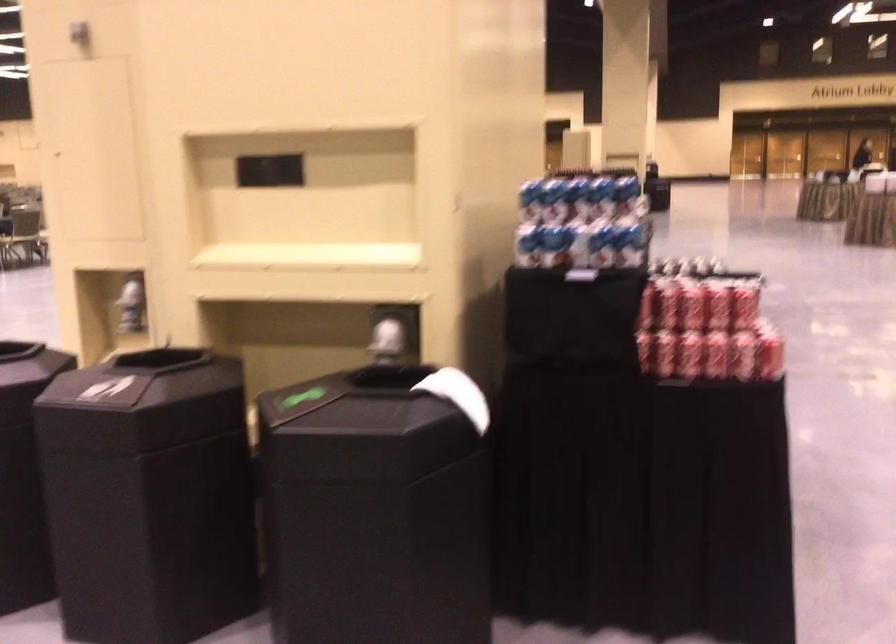
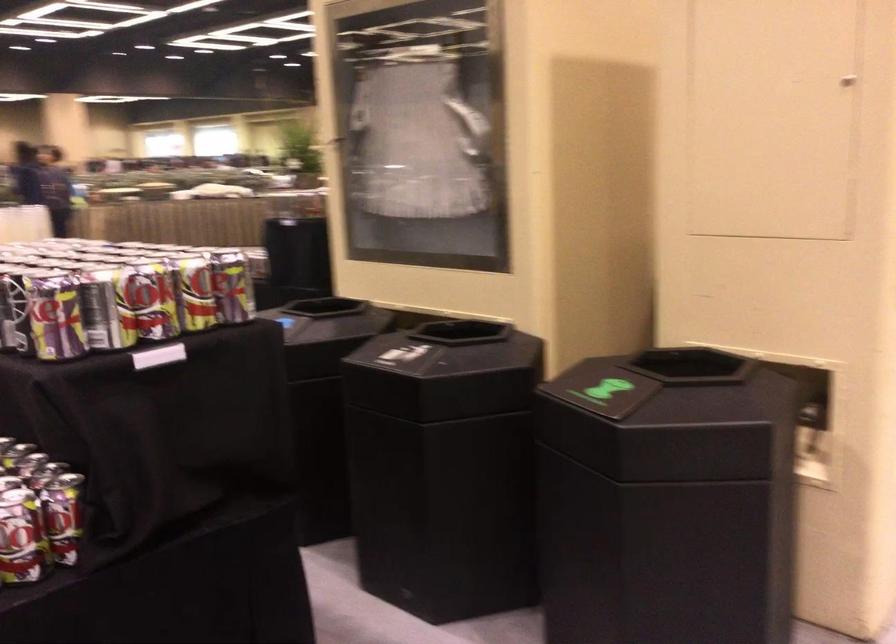
Question: I am providing you with two images of the same scene from different viewpoints. After the viewpoint changes to image2, which objects are now occluded?

Choices:
 (A) beverage can
 (B) black bin opening
 (C) guitar tuning key
 (D) blue and white can

Answer: (D)